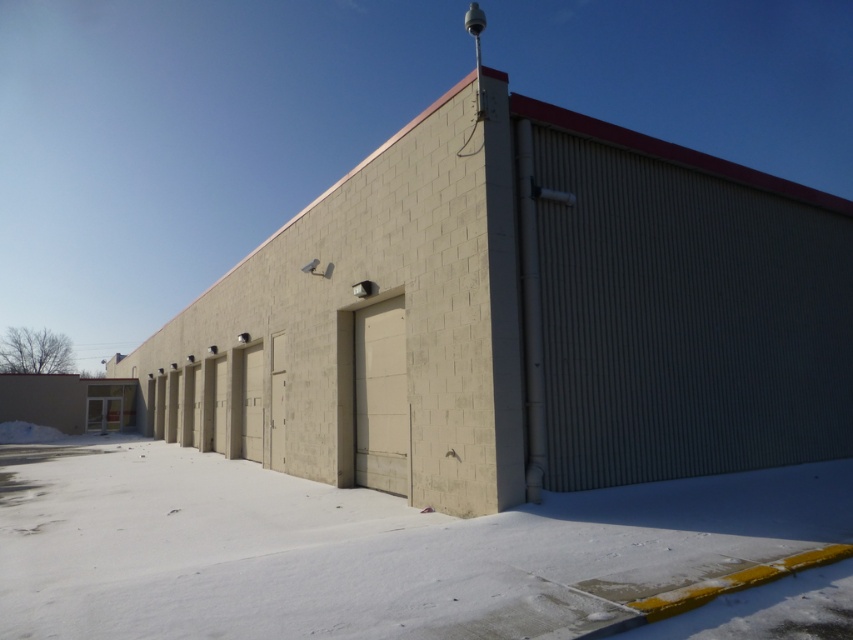
Question: Can you confirm if white powdery snow at lower center is bigger than gray corrugated metal at right?

Choices:
 (A) yes
 (B) no

Answer: (A)

Question: Which point is closer to the camera taking this photo?

Choices:
 (A) (236, 618)
 (B) (729, 195)

Answer: (A)

Question: Is the position of white powdery snow at lower center less distant than that of gray corrugated metal at right?

Choices:
 (A) yes
 (B) no

Answer: (A)

Question: Does white powdery snow at lower center appear on the right side of gray corrugated metal at right?

Choices:
 (A) yes
 (B) no

Answer: (B)

Question: Which of the following is the closest to the observer?

Choices:
 (A) white powdery snow at lower center
 (B) gray corrugated metal at right

Answer: (A)